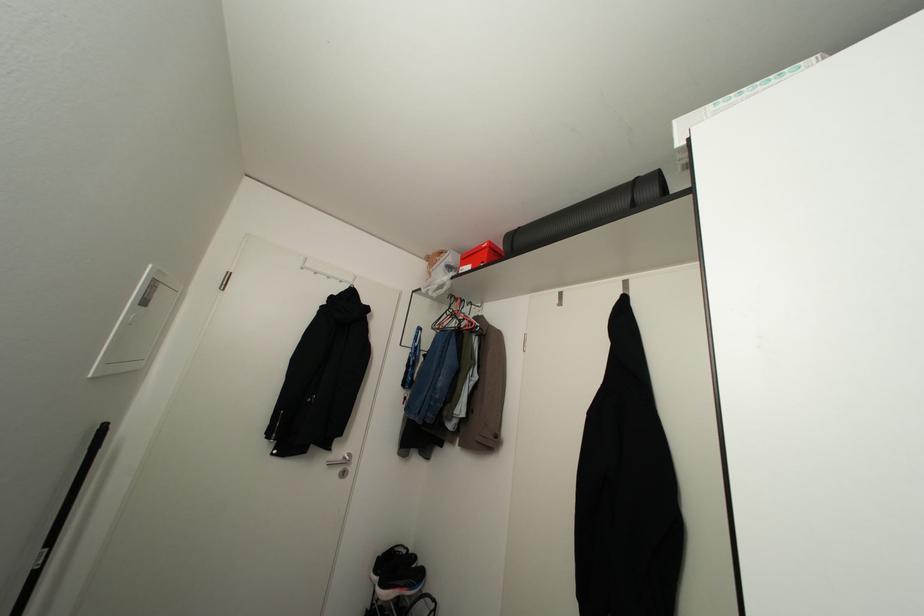
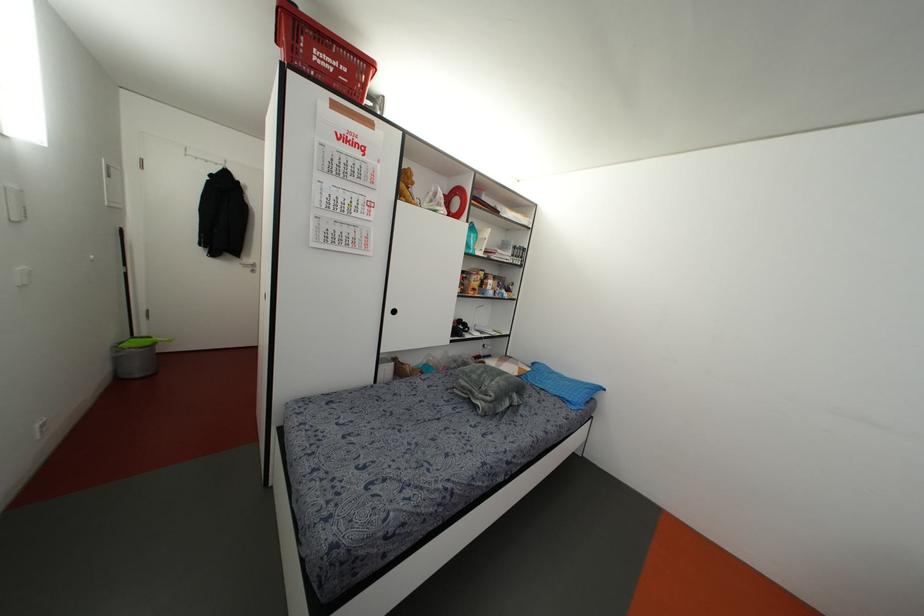
In the second image, find the point that corresponds to point 343,472 in the first image.

(252, 270)